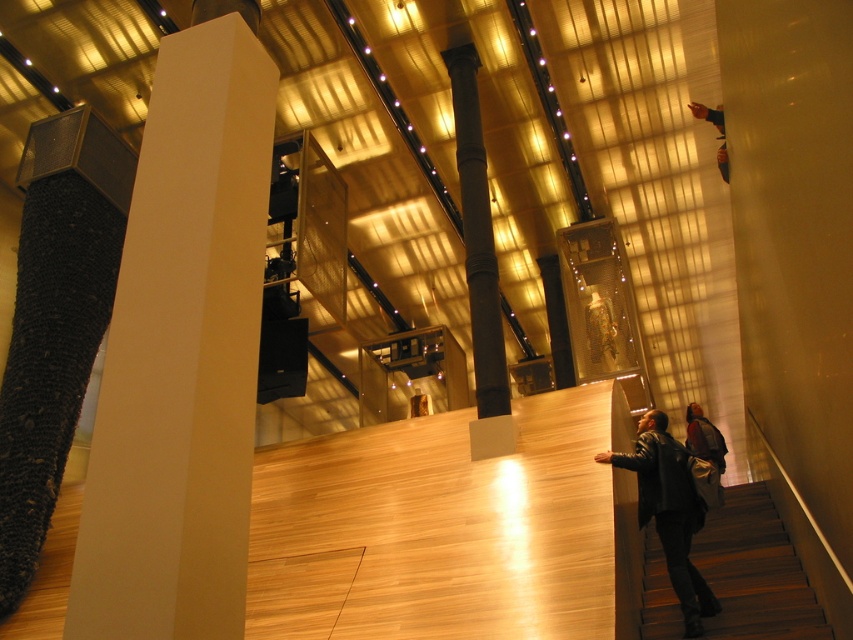
Question: Can you confirm if wooden stairs at lower right is positioned to the right of leather jacket at right?

Choices:
 (A) yes
 (B) no

Answer: (A)

Question: Considering the relative positions of dark brown leather jacket at lower right and blue fabric at upper right in the image provided, where is dark brown leather jacket at lower right located with respect to blue fabric at upper right?

Choices:
 (A) above
 (B) below

Answer: (B)

Question: Does black matte column at center lie behind leather jacket at right?

Choices:
 (A) no
 (B) yes

Answer: (B)

Question: Which object is the farthest from the blue fabric at upper right?

Choices:
 (A) wooden stairs at lower right
 (B) white smooth pillar at center

Answer: (B)

Question: Considering the real-world distances, which object is closest to the leather jacket at right?

Choices:
 (A) dark brown leather jacket at lower right
 (B) white smooth pillar at center
 (C) wooden stairs at lower right
 (D) blue fabric at upper right

Answer: (C)

Question: Which point is farther to the camera?

Choices:
 (A) (691, 436)
 (B) (451, 113)
 (C) (811, 621)
 (D) (695, 106)

Answer: (A)